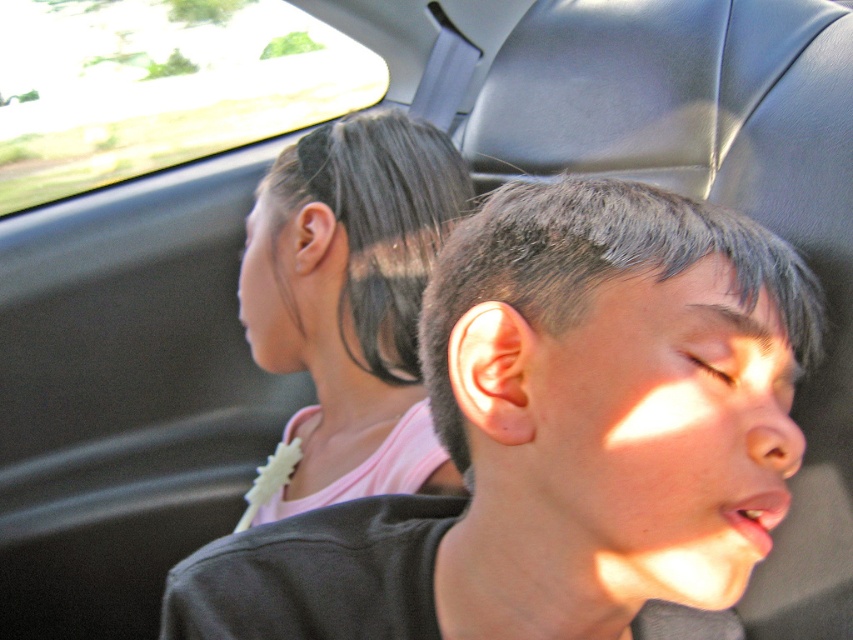
Question: Considering the relative positions of smooth pink shirt at left and transparent glass car window at upper left in the image provided, where is smooth pink shirt at left located with respect to transparent glass car window at upper left?

Choices:
 (A) left
 (B) right

Answer: (B)

Question: Which point is farther to the camera?

Choices:
 (A) (311, 88)
 (B) (331, 326)

Answer: (A)

Question: Is smooth pink shirt at left positioned before transparent glass car window at upper left?

Choices:
 (A) no
 (B) yes

Answer: (B)

Question: Can you confirm if smooth pink shirt at left is wider than transparent glass car window at upper left?

Choices:
 (A) no
 (B) yes

Answer: (A)

Question: Which of the following is the farthest from the observer?

Choices:
 (A) transparent glass car window at upper left
 (B) smooth pink shirt at left

Answer: (A)